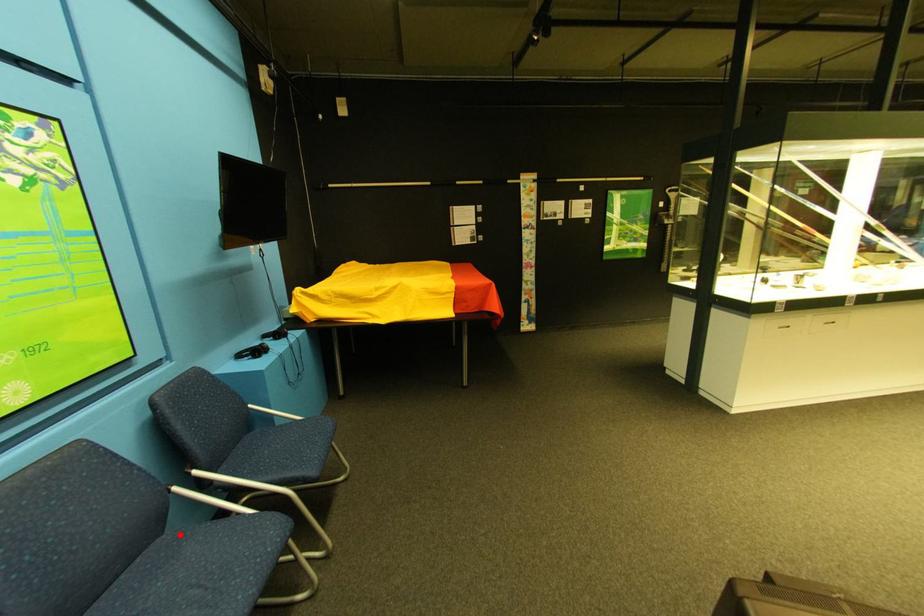
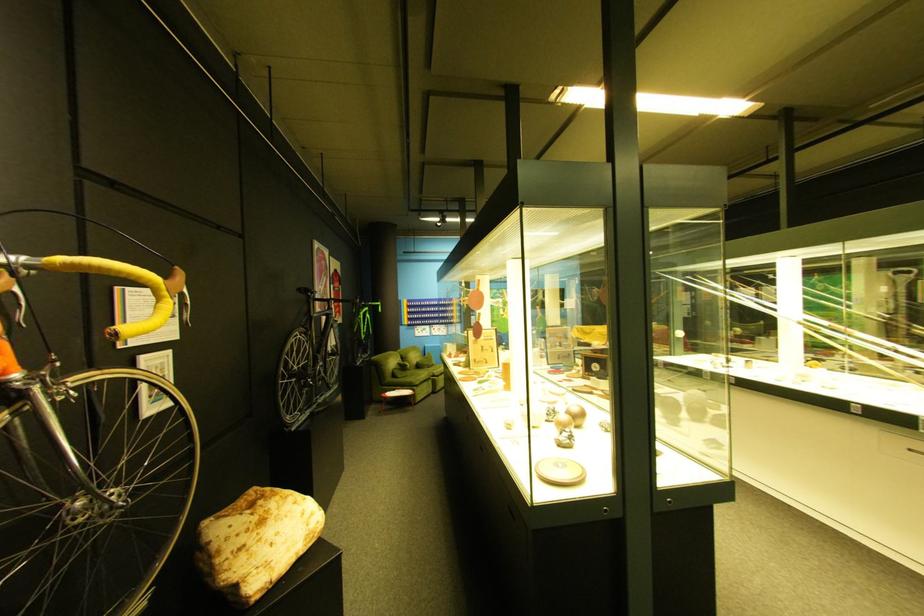
Question: I am providing you with two images of the same scene from different viewpoints. A red point is marked on the first image. Can you still see the location of the red point in image 2?

Choices:
 (A) Yes
 (B) No

Answer: (B)